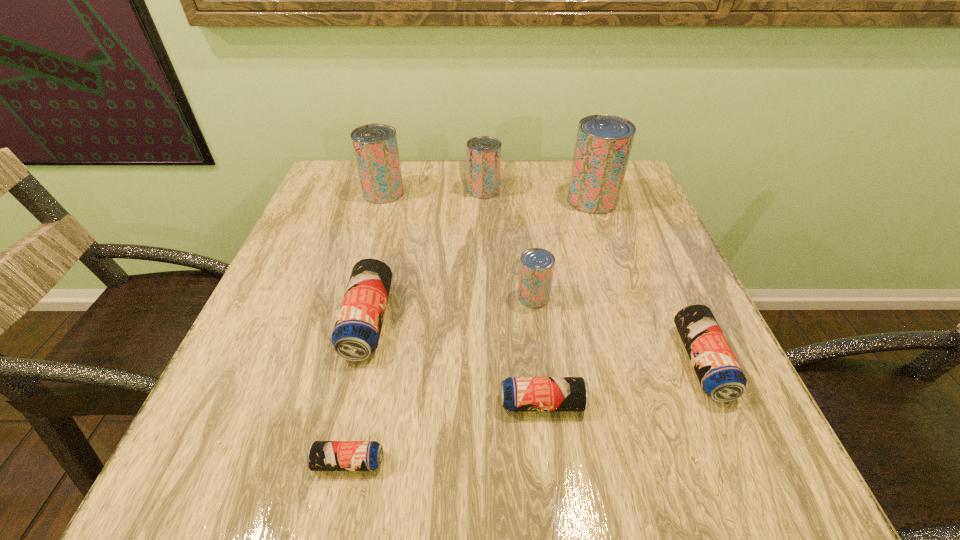
The width and height of the screenshot is (960, 540). In order to click on vacant space in between the second biggest blue beer can and the smallest blue beer can in this screenshot , I will do `click(525, 412)`.

Find the location of a particular element. vacant space that's between the nearest object and the fourth tallest beer can is located at coordinates (441, 380).

At what (x,y) coordinates should I click in order to perform the action: click on vacant region between the fifth shortest beer can and the third biggest blue beer can. Please return your answer as a coordinate pair (x, y). Image resolution: width=960 pixels, height=540 pixels. Looking at the image, I should click on (538, 350).

Where is `free space between the second tallest object and the fourth shortest object`? The width and height of the screenshot is (960, 540). free space between the second tallest object and the fourth shortest object is located at coordinates (375, 257).

At what (x,y) coordinates should I click in order to perform the action: click on vacant space that is in between the third shortest object and the third tallest beer can. Please return your answer as a coordinate pair (x, y). The width and height of the screenshot is (960, 540). Looking at the image, I should click on (593, 276).

Locate an element on the screen. free spot between the third smallest blue beer can and the nearest object is located at coordinates (525, 412).

In order to click on object that stands as the second closest to the fourth tallest beer can in this screenshot , I will do `click(719, 373)`.

The height and width of the screenshot is (540, 960). I want to click on the closest object to the second biggest red beer can, so click(483, 152).

Find the location of a particular element. beer can that stands as the sixth closest to the third red beer can from left to right is located at coordinates (322, 455).

Where is `beer can that stands as the fourth closest to the biggest blue beer can`? beer can that stands as the fourth closest to the biggest blue beer can is located at coordinates (375, 146).